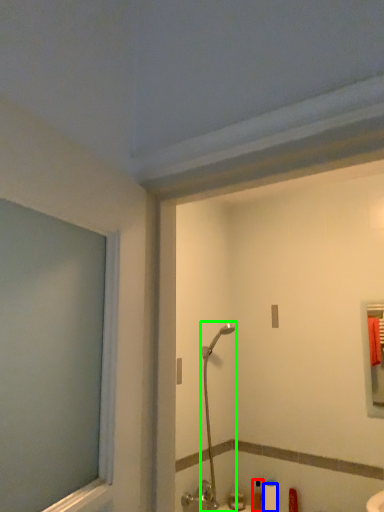
Question: Which object is the farthest from toiletry (highlighted by a red box)? Choose among these: toilet paper (highlighted by a blue box) or shower (highlighted by a green box).

Choices:
 (A) toilet paper
 (B) shower

Answer: (B)